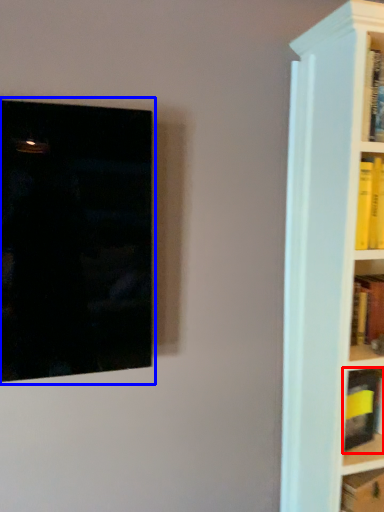
Question: Which of the following is the closest to the observer, book (highlighted by a red box) or picture frame (highlighted by a blue box)?

Choices:
 (A) book
 (B) picture frame

Answer: (B)